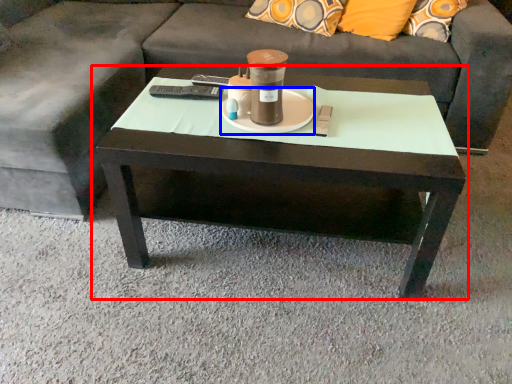
Question: Which object appears farthest to the camera in this image, coffee table (highlighted by a red box) or saucer (highlighted by a blue box)?

Choices:
 (A) coffee table
 (B) saucer

Answer: (B)